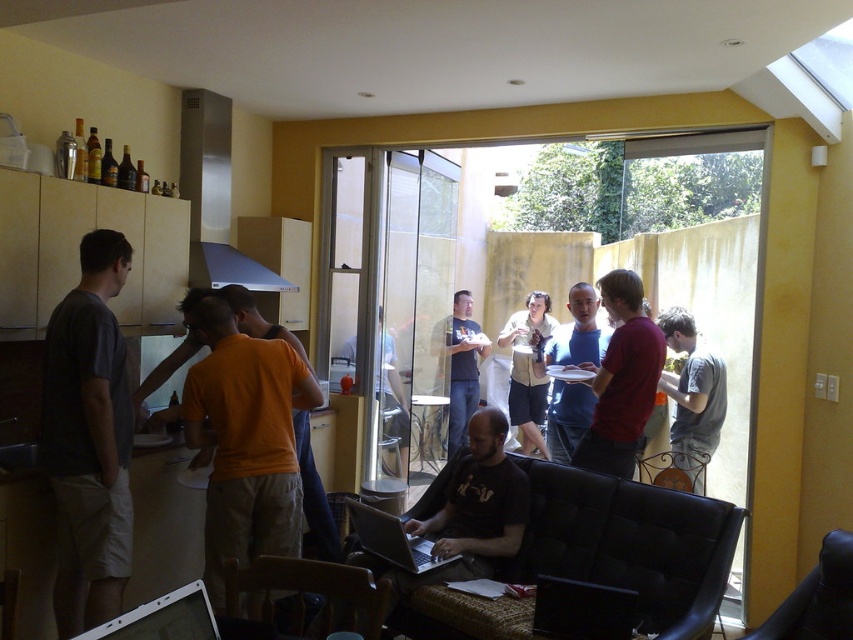
You are a delivery person who needs to hand over a package to the person wearing the light beige shorts at center. The package is too large to fit through the transparent glass door at center. Can you still deliver the package to the person without opening the door?

The transparent glass door at center is taller than the light beige shorts at center. Since the door is higher, you can slide the package under the door if there is enough space between the door and the floor to reach the person wearing the light beige shorts at center.

You are standing at the kitchenette counter and want to reach both the point at coordinates point (64, 465) and the point at coordinates point (381, 529). Which point should you reach for first to maintain the most efficient path?

You should reach for point (64, 465) first because it is in front of point (381, 529), so accessing it first allows you to efficiently move towards the latter without backtracking.